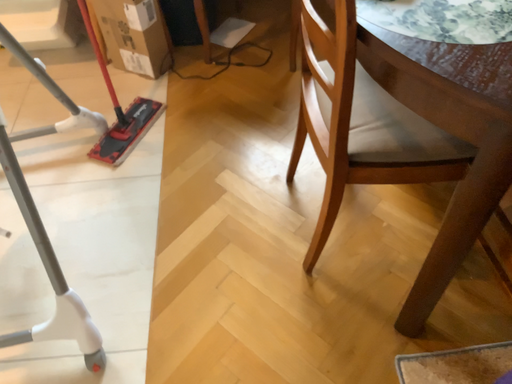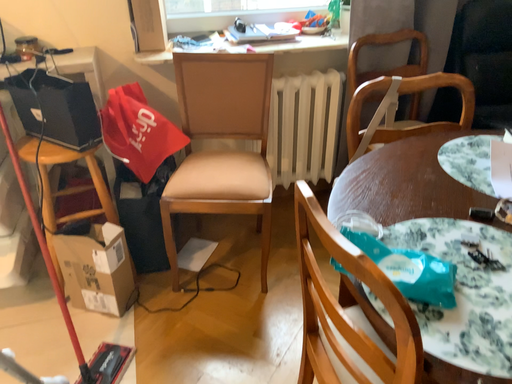
Question: Which way did the camera rotate in the video?

Choices:
 (A) rotated upward
 (B) rotated downward

Answer: (A)